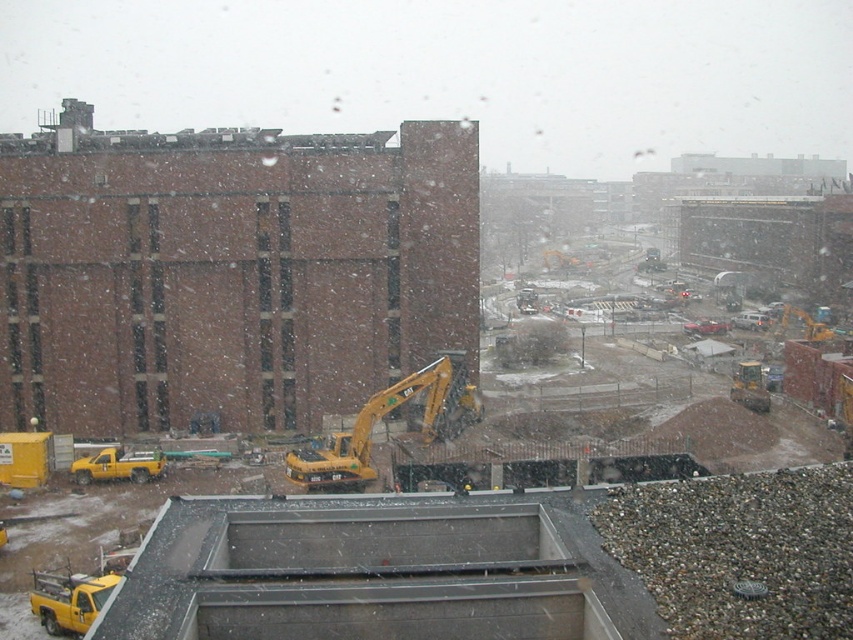
You are a delivery driver who needs to park your truck near the construction site. The yellow matte truck at lower left and the yellow rubber tractor at lower right are already parked. The parking area has a 30 meter length limit. Can both vehicles stay without moving?

The yellow matte truck at lower left is 29.96 meters away from the yellow rubber tractor at lower right. Since the distance between them is under the 30 meter limit, both vehicles can remain parked without needing to move.

From the picture: You are a delivery driver who needs to park your truck near the brick building at left without blocking the entrance. The entrance is located at point 0.3 on the x axis. Can you park your truck at point 0.4 on the x axis?

The brick building at left is located at point 0.425 on the x axis. The entrance is at 0.3, so parking at 0.4 would be between the entrance and the building, which might block access. Choose a spot further away from the entrance.